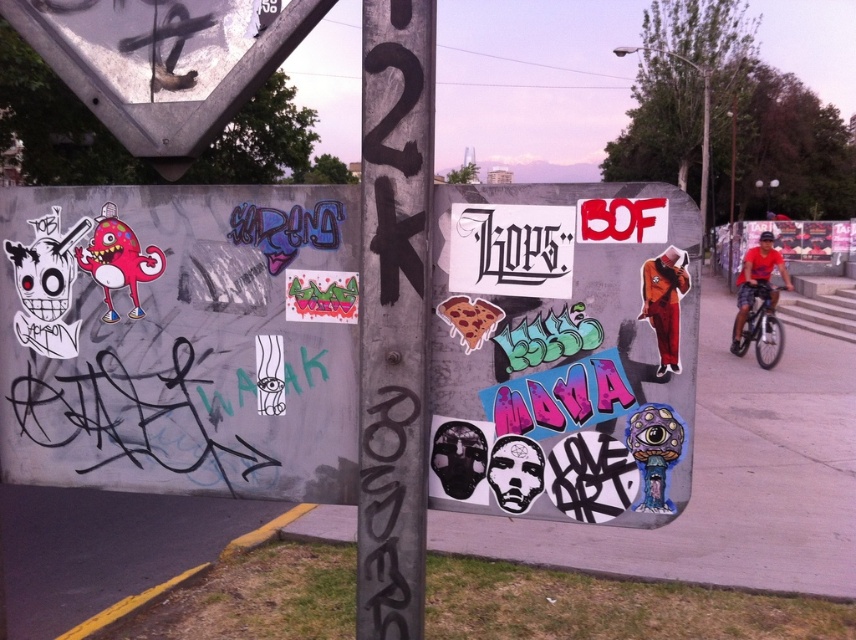
You are a delivery person who needs to deliver a package to the address located at the center of the white paper stickers. The coordinates of the delivery point are given as point (563, 349). Is the delivery point located on the white paper stickers at center?

Yes, the point (563, 349) is on the white paper stickers at center, so the delivery point is correctly located there.

You are an urban explorer who wants to take a photo of the white paper stickers at center and the black painted pole at center. Which object is shorter in height?

The white paper stickers at center is not as tall as the black painted pole at center, so the white paper stickers at center is shorter in height.